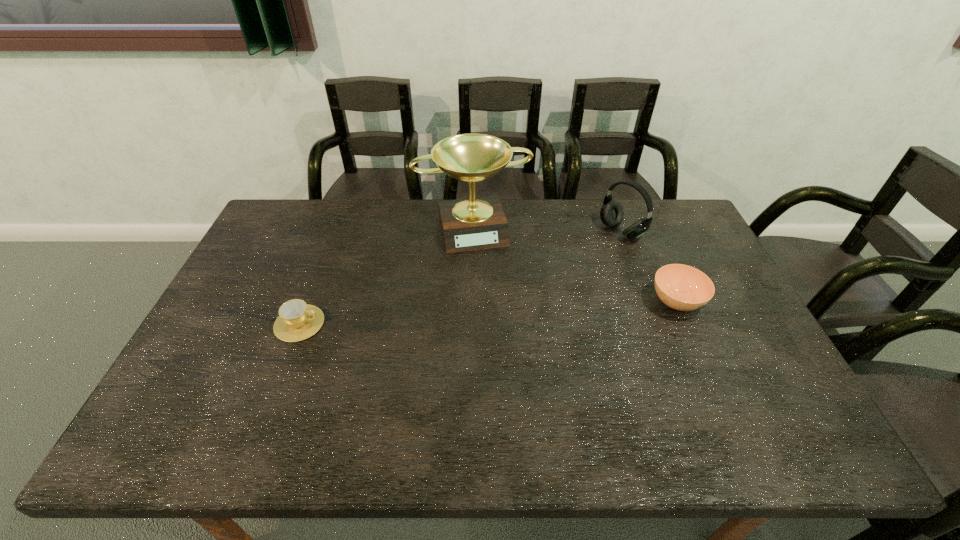
Identify the location of vacant area that lies between the headset and the leftmost object. (461, 278).

At what (x,y) coordinates should I click in order to perform the action: click on vacant space that's between the award and the soup bowl. Please return your answer as a coordinate pair (x, y). The image size is (960, 540). Looking at the image, I should click on [x=575, y=265].

Locate which object ranks second in proximity to the soup bowl. Please provide its 2D coordinates. Your answer should be formatted as a tuple, i.e. [(x, y)], where the tuple contains the x and y coordinates of a point satisfying the conditions above.

[(475, 223)]

Locate an element on the screen. The width and height of the screenshot is (960, 540). object that is the second closest to the tallest object is located at coordinates (297, 321).

Image resolution: width=960 pixels, height=540 pixels. I want to click on vacant point that satisfies the following two spatial constraints: 1. on the front side of the headset; 2. on the right side of the tallest object, so click(473, 231).